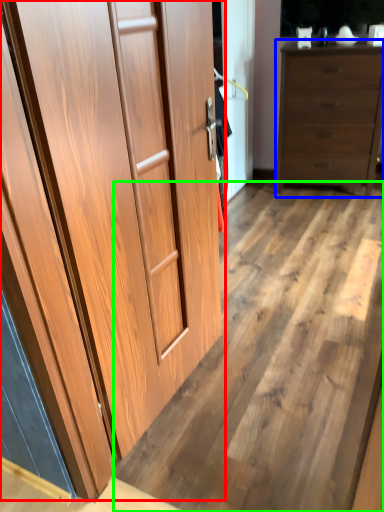
Question: Which is nearer to the cupboard (highlighted by a red box)? chest of drawers (highlighted by a blue box) or plywood (highlighted by a green box).

Choices:
 (A) chest of drawers
 (B) plywood

Answer: (B)